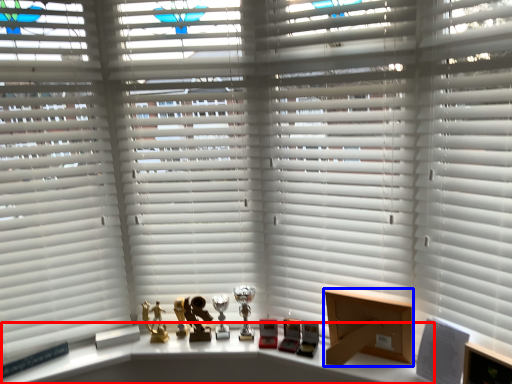
Question: Which point is further to the camera, table (highlighted by a red box) or cardboard box (highlighted by a blue box)?

Choices:
 (A) table
 (B) cardboard box

Answer: (B)